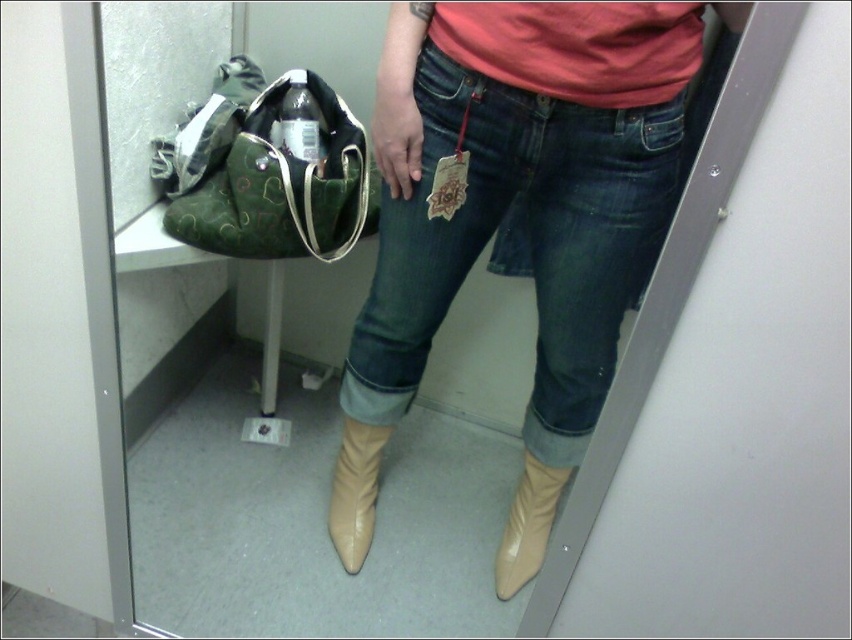
Between denim at center and green canvas handbag at left, which one is positioned higher?

Positioned higher is green canvas handbag at left.

Can you confirm if denim at center is smaller than green canvas handbag at left?

Actually, denim at center might be larger than green canvas handbag at left.

Measure the distance between point (464, 104) and camera.

3.30 feet

This screenshot has height=640, width=852. Identify the location of denim at center. (528, 241).

Which is more to the left, denim at center or beige leather boot at lower center?

denim at center is more to the left.

Between denim at center and beige leather boot at lower center, which one has more height?

With more height is denim at center.

Identify the location of denim at center. This screenshot has width=852, height=640. (528, 241).

Is the position of denim at center less distant than that of tan leather boot at center?

That is True.

Is point (556, 182) positioned behind point (343, 534)?

That is False.

Identify the location of denim at center. (528, 241).